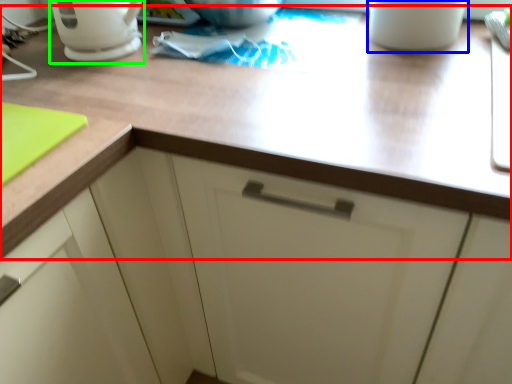
Question: Estimate the real-world distances between objects in this image. Which object is farther from countertop (highlighted by a red box), mug (highlighted by a blue box) or coffeepot (highlighted by a green box)?

Choices:
 (A) mug
 (B) coffeepot

Answer: (B)